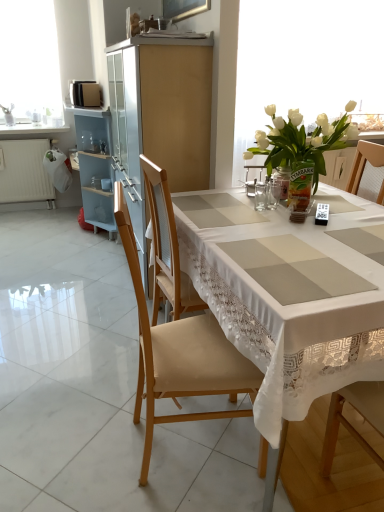
Question: Looking at the image, does translucent glass vase at upper right seem bigger or smaller compared to wooden chair at center, marked as the first chair in a back-to-front arrangement?

Choices:
 (A) small
 (B) big

Answer: (A)

Question: In the image, is translucent glass vase at upper right positioned in front of or behind wooden chair at center, placed as the 2th chair when sorted from front to back?

Choices:
 (A) front
 (B) behind

Answer: (B)

Question: Considering the real-world distances, which object is closest to the white lace tablecloth at center?

Choices:
 (A) wooden chair at center, marked as the first chair in a back-to-front arrangement
 (B) white glass vase at upper right
 (C) white glossy countertop at upper left
 (D) clear glass jar at center
 (E) matte wood cabinet at center

Answer: (A)

Question: Which of these objects is positioned farthest from the matte wood cabinet at center?

Choices:
 (A) wooden chair at center, which ranks as the 2th chair in back-to-front order
 (B) translucent glass vase at upper right
 (C) wooden chair at center, placed as the 2th chair when sorted from front to back
 (D) white lace tablecloth at center
 (E) white matte radiator at left

Answer: (E)